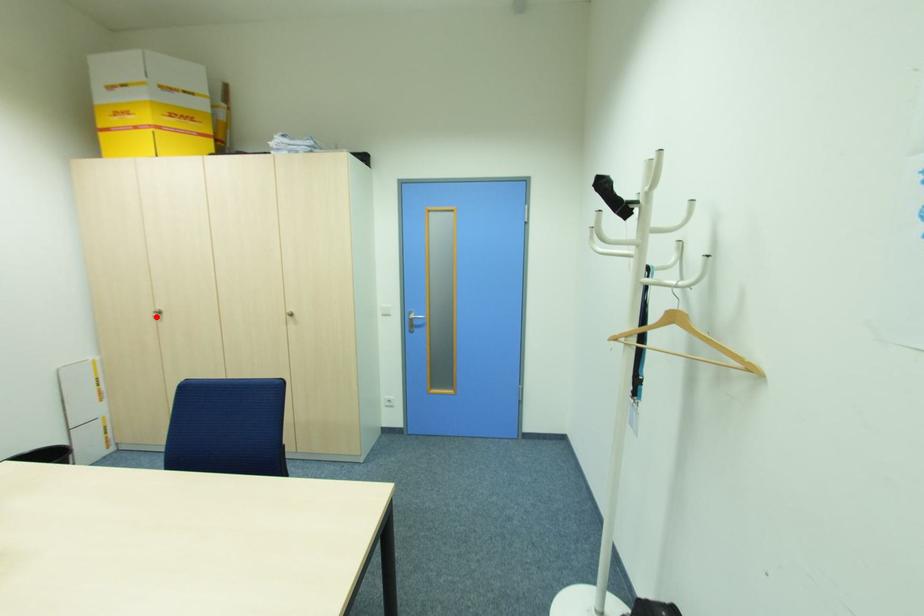
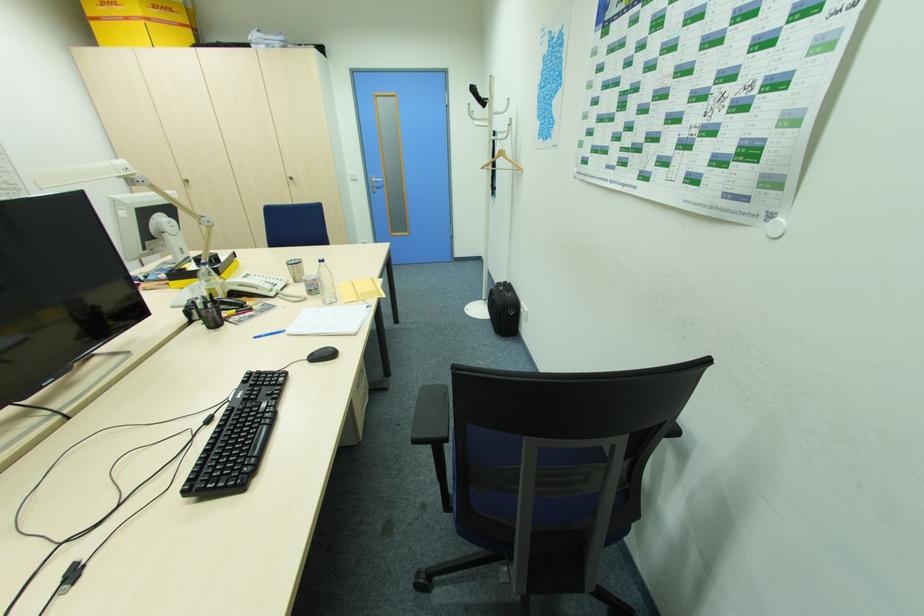
In the second image, find the point that corresponds to the highlighted location in the first image.

(188, 185)